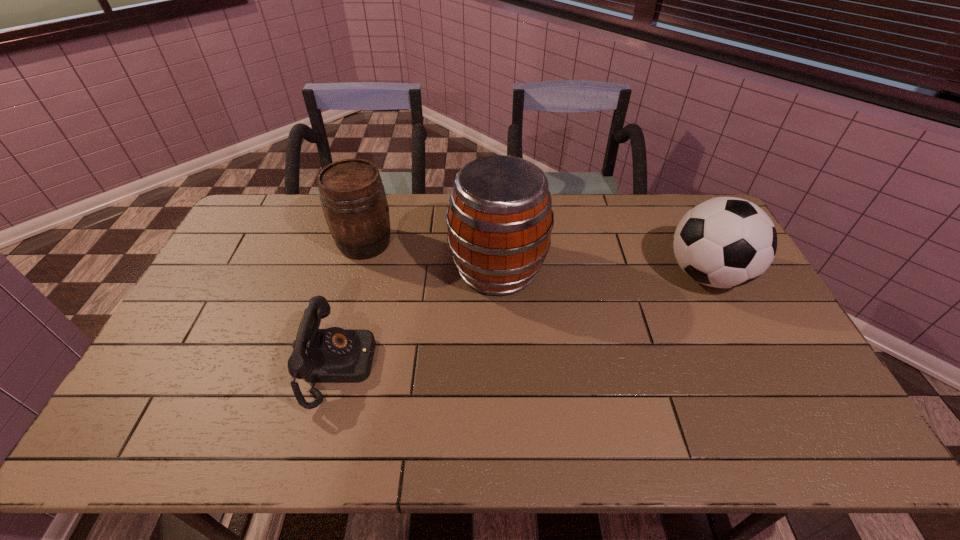
Where is `free area in between the second object from right to left and the nearest object`? Image resolution: width=960 pixels, height=540 pixels. free area in between the second object from right to left and the nearest object is located at coordinates (419, 317).

What are the coordinates of `free space between the shortest object and the right cider` in the screenshot? It's located at (419, 317).

Locate which object ranks in proximity to the rightmost object. Please provide its 2D coordinates. Your answer should be formatted as a tuple, i.e. [(x, y)], where the tuple contains the x and y coordinates of a point satisfying the conditions above.

[(499, 220)]

The width and height of the screenshot is (960, 540). Find the location of `the third closest object to the shortest object`. the third closest object to the shortest object is located at coordinates (724, 242).

Find the location of a particular element. free space that satisfies the following two spatial constraints: 1. on the side of the left cider near the bung hole; 2. on the left side of the rightmost object is located at coordinates (356, 274).

The width and height of the screenshot is (960, 540). I want to click on free region that satisfies the following two spatial constraints: 1. on the side of the second object from right to left near the bung hole; 2. on the left side of the shorter cider, so click(x=358, y=269).

Locate an element on the screen. This screenshot has height=540, width=960. vacant space that satisfies the following two spatial constraints: 1. on the front side of the taller cider; 2. on the dial of the nearest object is located at coordinates point(502,366).

Find the location of a particular element. free region that satisfies the following two spatial constraints: 1. on the side of the shorter cider near the bung hole; 2. on the left side of the tallest object is located at coordinates (358, 269).